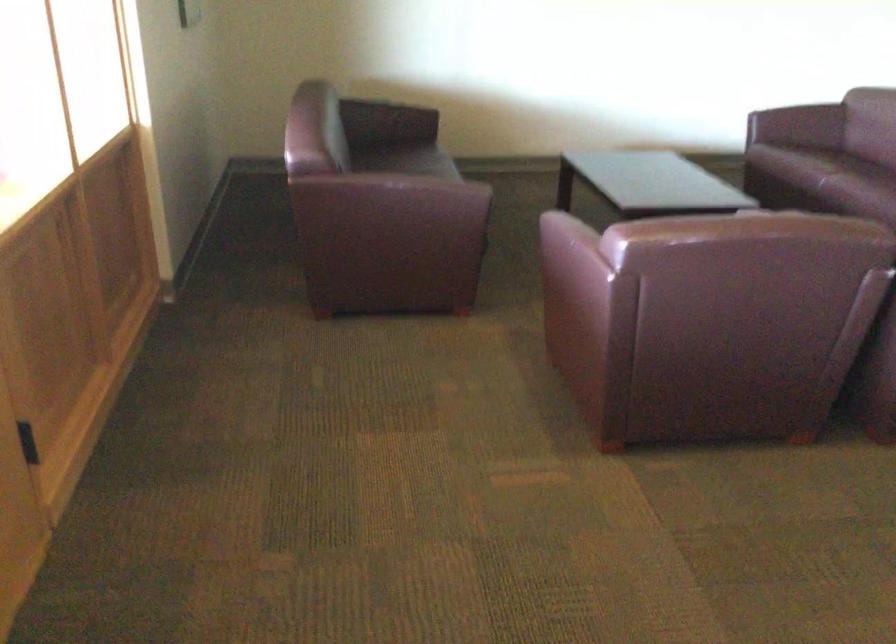
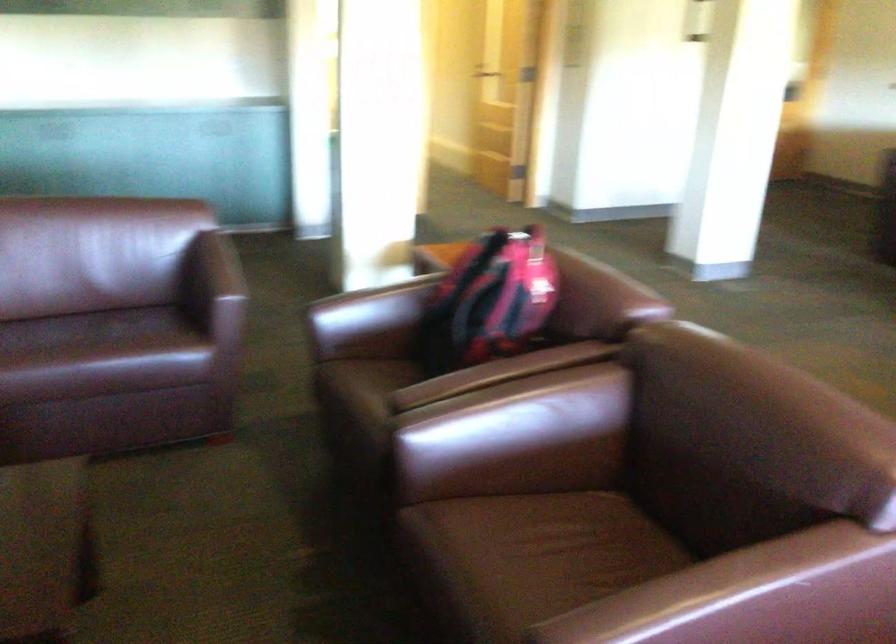
The images are taken continuously from a first-person perspective. In which direction is your viewpoint rotating?

The camera's rotation is toward right-down.